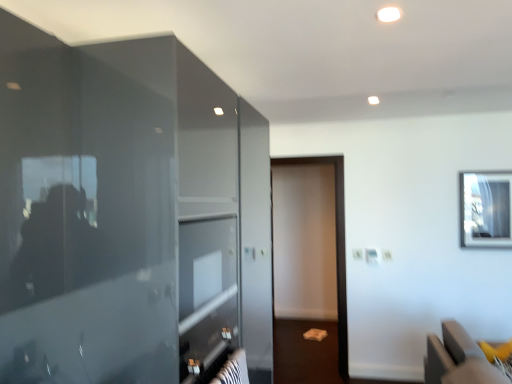
This screenshot has height=384, width=512. What do you see at coordinates (458, 359) in the screenshot?
I see `yellow fabric cushion at lower right` at bounding box center [458, 359].

Locate an element on the screen. brown matte screen door at center is located at coordinates tap(336, 247).

Identify the location of clear glass window at upper right. This screenshot has width=512, height=384. (486, 209).

The width and height of the screenshot is (512, 384). Describe the element at coordinates (486, 209) in the screenshot. I see `clear glass window at upper right` at that location.

Identify the location of glossy glass door at left. (83, 218).

Looking at this image, from the image's perspective, who appears lower, yellow fabric cushion at lower right or glossy glass door at left?

yellow fabric cushion at lower right is shown below in the image.

Which object is wider, yellow fabric cushion at lower right or glossy glass door at left?

glossy glass door at left.

Find the location of a particular element. This screenshot has width=512, height=384. glass door that appears in front of the yellow fabric cushion at lower right is located at coordinates (83, 218).

Which is more to the left, yellow fabric cushion at lower right or glossy glass door at left?

Positioned to the left is glossy glass door at left.

Is clear glass window at upper right next to brown matte screen door at center and touching it?

clear glass window at upper right and brown matte screen door at center are clearly separated.

Which point is more forward, (493, 241) or (340, 307)?

The point (493, 241) is closer.

Where is `screen door below the clear glass window at upper right (from the image's perspective)`? The height and width of the screenshot is (384, 512). screen door below the clear glass window at upper right (from the image's perspective) is located at coordinates (336, 247).

From the image's perspective, does clear glass window at upper right appear higher than brown matte screen door at center?

Indeed, from the image's perspective, clear glass window at upper right is shown above brown matte screen door at center.

Which is closer, (449, 325) or (339, 155)?

Point (449, 325).

Who is bigger, yellow fabric cushion at lower right or brown matte screen door at center?

brown matte screen door at center.

Is yellow fabric cushion at lower right not within brown matte screen door at center?

Yes.

This screenshot has height=384, width=512. Identify the location of furniture below the brown matte screen door at center (from a real-world perspective). (458, 359).

Who is smaller, glossy glass door at left or brown matte screen door at center?

brown matte screen door at center is smaller.

Based on the photo, from a real-world perspective, does glossy glass door at left sit lower than brown matte screen door at center?

Incorrect, from a real-world perspective, glossy glass door at left is higher than brown matte screen door at center.

Is glossy glass door at left oriented towards brown matte screen door at center?

No, glossy glass door at left is not facing towards brown matte screen door at center.

This screenshot has height=384, width=512. In order to click on glass door on the left of brown matte screen door at center in this screenshot , I will do `click(83, 218)`.

Is yellow fabric cushion at lower right further to the viewer compared to clear glass window at upper right?

No, yellow fabric cushion at lower right is in front of clear glass window at upper right.

Is yellow fabric cushion at lower right oriented towards clear glass window at upper right?

No, yellow fabric cushion at lower right does not turn towards clear glass window at upper right.

In terms of height, does yellow fabric cushion at lower right look taller or shorter compared to clear glass window at upper right?

Clearly, yellow fabric cushion at lower right is shorter compared to clear glass window at upper right.

Is brown matte screen door at center thinner than glossy glass door at left?

Yes, brown matte screen door at center is thinner than glossy glass door at left.

From the image's perspective, does brown matte screen door at center appear higher than glossy glass door at left?

Incorrect, from the image's perspective, brown matte screen door at center is lower than glossy glass door at left.

Is brown matte screen door at center turned away from glossy glass door at left?

That's not correct — brown matte screen door at center is not looking away from glossy glass door at left.

From a real-world perspective, which is physically above, brown matte screen door at center or yellow fabric cushion at lower right?

brown matte screen door at center.

In order to click on screen door above the yellow fabric cushion at lower right (from a real-world perspective) in this screenshot , I will do `click(336, 247)`.

Considering the relative sizes of brown matte screen door at center and yellow fabric cushion at lower right in the image provided, is brown matte screen door at center wider than yellow fabric cushion at lower right?

Incorrect, the width of brown matte screen door at center does not surpass that of yellow fabric cushion at lower right.

Could you tell me if brown matte screen door at center is turned towards yellow fabric cushion at lower right?

No, brown matte screen door at center is not aimed at yellow fabric cushion at lower right.

Identify the location of glass door on the left of yellow fabric cushion at lower right. The image size is (512, 384). (83, 218).

Find the location of a particular element. window above the brown matte screen door at center (from the image's perspective) is located at coordinates (486, 209).

Estimate the real-world distances between objects in this image. Which object is closer to glossy glass door at left, brown matte screen door at center or yellow fabric cushion at lower right?

yellow fabric cushion at lower right.

Estimate the real-world distances between objects in this image. Which object is closer to brown matte screen door at center, yellow fabric cushion at lower right or glossy glass door at left?

yellow fabric cushion at lower right lies closer to brown matte screen door at center than the other object.

When comparing their distances from clear glass window at upper right, does yellow fabric cushion at lower right or glossy glass door at left seem closer?

Among the two, yellow fabric cushion at lower right is located nearer to clear glass window at upper right.

From the image, which object appears to be farther from brown matte screen door at center, glossy glass door at left or yellow fabric cushion at lower right?

The object further to brown matte screen door at center is glossy glass door at left.

Based on their spatial positions, is clear glass window at upper right or brown matte screen door at center closer to glossy glass door at left?

brown matte screen door at center lies closer to glossy glass door at left than the other object.

Based on their spatial positions, is glossy glass door at left or clear glass window at upper right closer to yellow fabric cushion at lower right?

Among the two, clear glass window at upper right is located nearer to yellow fabric cushion at lower right.

Which object lies further to the anchor point yellow fabric cushion at lower right, brown matte screen door at center or glossy glass door at left?

glossy glass door at left.

Considering their positions, is brown matte screen door at center positioned further to glossy glass door at left than clear glass window at upper right?

Among the two, clear glass window at upper right is located further to glossy glass door at left.

Where is `window positioned between glossy glass door at left and brown matte screen door at center from near to far`? The height and width of the screenshot is (384, 512). window positioned between glossy glass door at left and brown matte screen door at center from near to far is located at coordinates (486, 209).

Identify the location of furniture located between glossy glass door at left and clear glass window at upper right in the left-right direction. The image size is (512, 384). (458, 359).

Where is `furniture between brown matte screen door at center and clear glass window at upper right in the horizontal direction`? This screenshot has height=384, width=512. furniture between brown matte screen door at center and clear glass window at upper right in the horizontal direction is located at coordinates (458, 359).

The image size is (512, 384). In order to click on furniture located between glossy glass door at left and brown matte screen door at center in the depth direction in this screenshot , I will do `click(458, 359)`.